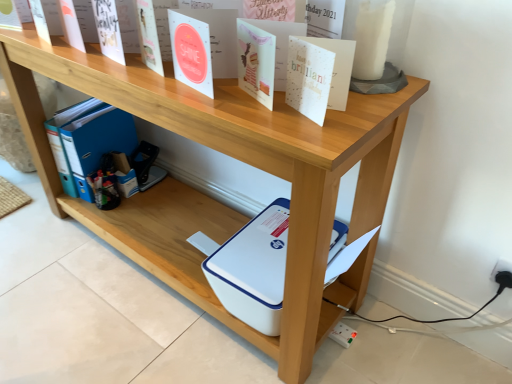
Where is `spots to the right of white paper at upper center, the second paperback book viewed from the left`? The image size is (512, 384). spots to the right of white paper at upper center, the second paperback book viewed from the left is located at coordinates (366, 108).